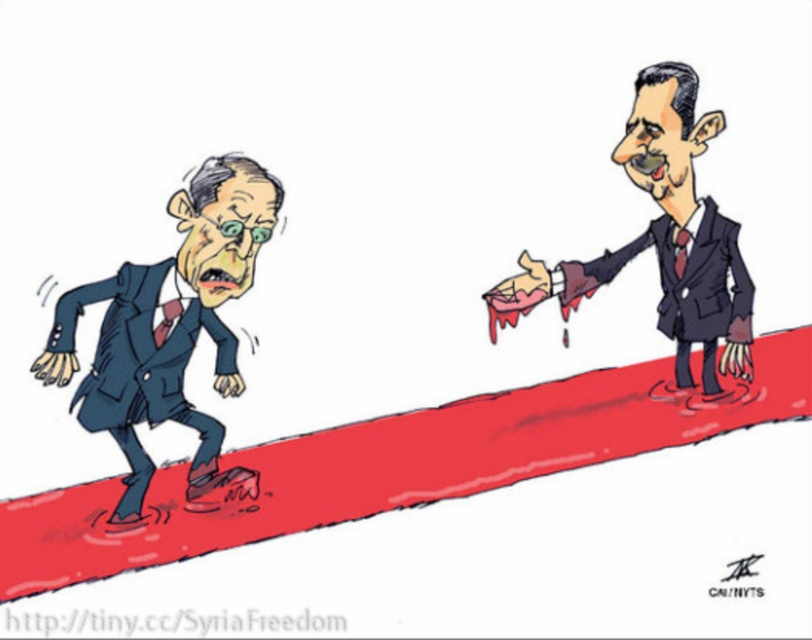
Question: Based on their relative distances, which object is farther from the smooth suit at upper right?

Choices:
 (A) matte blue suit at left
 (B) dark blue suit at right

Answer: (A)

Question: Which point is farther to the camera?

Choices:
 (A) smooth suit at upper right
 (B) matte blue suit at left

Answer: (A)

Question: Observing the image, what is the correct spatial positioning of matte blue suit at left in reference to dark blue suit at right?

Choices:
 (A) below
 (B) above

Answer: (A)

Question: Which of these objects is positioned farthest from the smooth suit at upper right?

Choices:
 (A) matte blue suit at left
 (B) dark blue suit at right

Answer: (A)

Question: Is matte blue suit at left smaller than smooth suit at upper right?

Choices:
 (A) yes
 (B) no

Answer: (B)

Question: Does smooth suit at upper right have a greater width compared to dark blue suit at right?

Choices:
 (A) no
 (B) yes

Answer: (B)